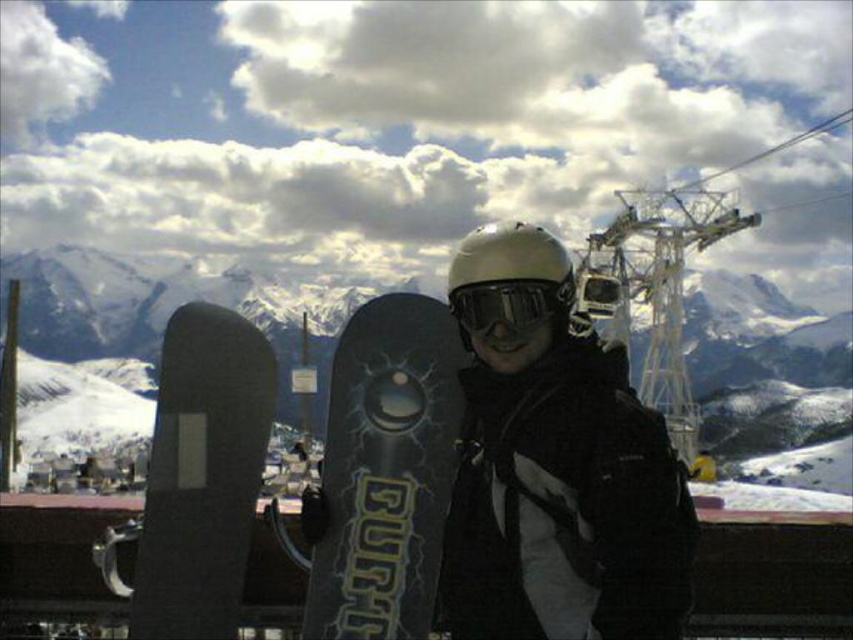
Between point (393, 529) and point (495, 264), which one is positioned in front?

Positioned in front is point (393, 529).

This screenshot has height=640, width=853. I want to click on black matte snowboard at center, so click(383, 472).

Which is behind, point (306, 532) or point (486, 291)?

The point (306, 532) is more distant.

Does point (397, 556) come behind point (477, 289)?

No, it is not.

Which is behind, point (323, 593) or point (498, 284)?

The point (498, 284) is more distant.

At what (x,y) coordinates should I click in order to perform the action: click on black matte snowboard at center. Please return your answer as a coordinate pair (x, y). The height and width of the screenshot is (640, 853). Looking at the image, I should click on tap(383, 472).

Is snowy mountain at center to the left of black matte snowboard at center from the viewer's perspective?

Indeed, snowy mountain at center is positioned on the left side of black matte snowboard at center.

Does snowy mountain at center appear under black matte snowboard at center?

No, snowy mountain at center is not below black matte snowboard at center.

Where is `snowy mountain at center`? This screenshot has width=853, height=640. snowy mountain at center is located at coordinates (769, 381).